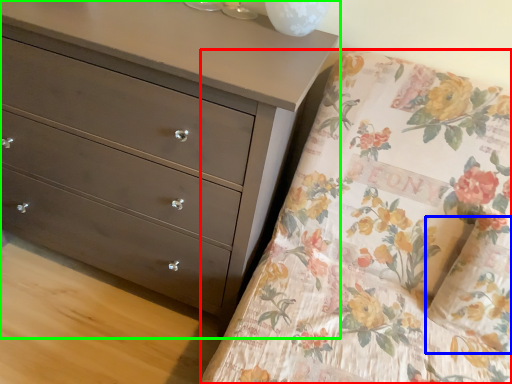
Question: Based on their relative distances, which object is farther from mattress (highlighted by a red box)? Choose from pillow (highlighted by a blue box) and chest of drawers (highlighted by a green box).

Choices:
 (A) pillow
 (B) chest of drawers

Answer: (B)